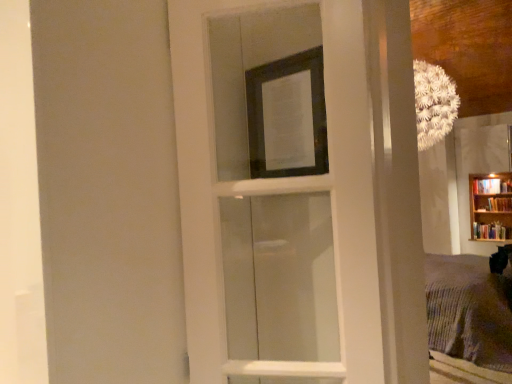
Question: Is white glass door at center turned away from transparent glass screen door at upper center?

Choices:
 (A) no
 (B) yes

Answer: (A)

Question: Is white glass door at center not near transparent glass screen door at upper center?

Choices:
 (A) no
 (B) yes

Answer: (A)

Question: Does white glass door at center have a larger size compared to transparent glass screen door at upper center?

Choices:
 (A) yes
 (B) no

Answer: (B)

Question: Can you confirm if white glass door at center is positioned to the right of transparent glass screen door at upper center?

Choices:
 (A) no
 (B) yes

Answer: (B)

Question: Is white glass door at center closer to camera compared to transparent glass screen door at upper center?

Choices:
 (A) no
 (B) yes

Answer: (A)

Question: Considering their positions, is matte black picture frame at upper center located in front of or behind transparent glass screen door at upper center?

Choices:
 (A) front
 (B) behind

Answer: (B)

Question: From the image's perspective, is matte black picture frame at upper center above or below transparent glass screen door at upper center?

Choices:
 (A) above
 (B) below

Answer: (A)

Question: From their relative heights in the image, would you say matte black picture frame at upper center is taller or shorter than transparent glass screen door at upper center?

Choices:
 (A) tall
 (B) short

Answer: (B)

Question: Do you think matte black picture frame at upper center is within transparent glass screen door at upper center, or outside of it?

Choices:
 (A) inside
 (B) outside

Answer: (B)

Question: Looking at the image, does white glass door at center seem bigger or smaller compared to transparent glass screen door at upper center?

Choices:
 (A) small
 (B) big

Answer: (A)

Question: In terms of width, does white glass door at center look wider or thinner when compared to transparent glass screen door at upper center?

Choices:
 (A) wide
 (B) thin

Answer: (B)

Question: From a real-world perspective, is white glass door at center above or below transparent glass screen door at upper center?

Choices:
 (A) above
 (B) below

Answer: (A)

Question: From the image's perspective, relative to transparent glass screen door at upper center, is white glass door at center above or below?

Choices:
 (A) below
 (B) above

Answer: (B)

Question: Is point (134, 74) closer or farther from the camera than point (480, 223)?

Choices:
 (A) farther
 (B) closer

Answer: (B)

Question: Would you say transparent glass screen door at upper center is to the left or to the right of wooden bookcase at right in the picture?

Choices:
 (A) right
 (B) left

Answer: (B)